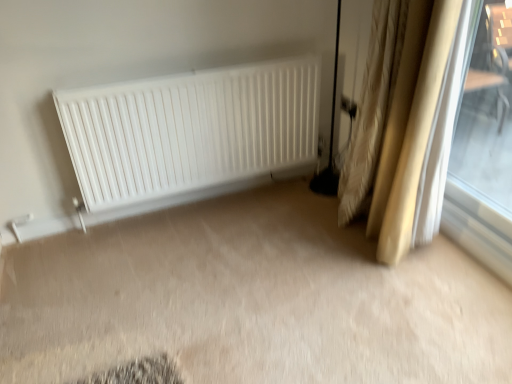
Question: Is beige textured curtains at right oriented towards white matte radiator at center?

Choices:
 (A) no
 (B) yes

Answer: (A)

Question: From a real-world perspective, is beige textured curtains at right positioned under white matte radiator at center based on gravity?

Choices:
 (A) yes
 (B) no

Answer: (B)

Question: Is the position of beige textured curtains at right less distant than that of white matte radiator at center?

Choices:
 (A) no
 (B) yes

Answer: (B)

Question: Is beige textured curtains at right taller than white matte radiator at center?

Choices:
 (A) yes
 (B) no

Answer: (A)

Question: Is beige textured curtains at right to the right of white matte radiator at center from the viewer's perspective?

Choices:
 (A) no
 (B) yes

Answer: (B)

Question: Is transparent glass window at right to the left or to the right of white matte radiator at center in the image?

Choices:
 (A) left
 (B) right

Answer: (B)

Question: From a real-world perspective, relative to white matte radiator at center, is transparent glass window at right vertically above or below?

Choices:
 (A) below
 (B) above

Answer: (B)

Question: In terms of width, does transparent glass window at right look wider or thinner when compared to white matte radiator at center?

Choices:
 (A) thin
 (B) wide

Answer: (A)

Question: Considering their positions, is transparent glass window at right located in front of or behind white matte radiator at center?

Choices:
 (A) behind
 (B) front

Answer: (B)

Question: Does point (75, 109) appear closer or farther from the camera than point (475, 99)?

Choices:
 (A) farther
 (B) closer

Answer: (B)

Question: Considering their positions, is white matte radiator at center located in front of or behind transparent glass window at right?

Choices:
 (A) front
 (B) behind

Answer: (B)

Question: From their relative heights in the image, would you say white matte radiator at center is taller or shorter than transparent glass window at right?

Choices:
 (A) tall
 (B) short

Answer: (B)

Question: Would you say white matte radiator at center is inside or outside transparent glass window at right?

Choices:
 (A) inside
 (B) outside

Answer: (B)

Question: Relative to beige textured curtains at right, is white matte radiator at center in front or behind?

Choices:
 (A) behind
 (B) front

Answer: (A)

Question: From the image's perspective, is white matte radiator at center positioned above or below beige textured curtains at right?

Choices:
 (A) above
 (B) below

Answer: (B)